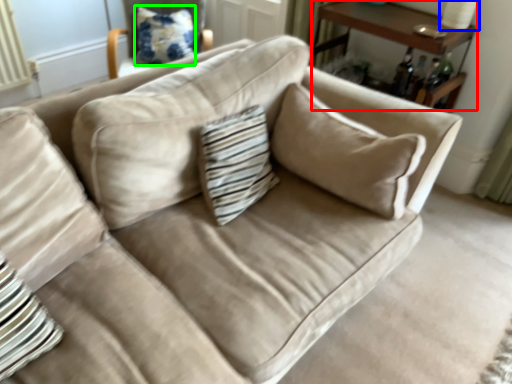
Question: Considering the real-world distances, which object is farthest from table (highlighted by a red box)? table lamp (highlighted by a blue box) or pillow (highlighted by a green box)?

Choices:
 (A) table lamp
 (B) pillow

Answer: (B)